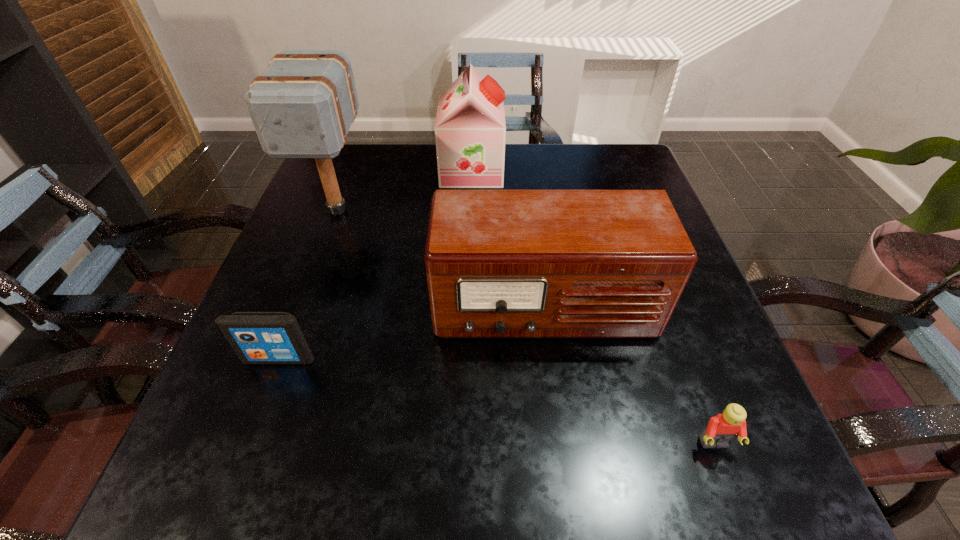
I want to click on free space at the far edge of the desktop, so click(395, 181).

You are a GUI agent. You are given a task and a screenshot of the screen. Output one action in this format:
    pyautogui.click(x=<x>, y=<y>)
    Task: Click on the blank space at the near edge of the desktop
    Image resolution: width=960 pixels, height=540 pixels.
    Given the screenshot: What is the action you would take?
    pyautogui.click(x=319, y=474)

Locate an element on the screen. free space at the left edge is located at coordinates (348, 218).

This screenshot has width=960, height=540. I want to click on vacant space at the near left corner, so click(x=267, y=455).

At what (x,y) coordinates should I click in order to perform the action: click on free region at the far right corner of the desktop. Please return your answer as a coordinate pair (x, y). Looking at the image, I should click on (594, 183).

Where is `empty space between the iPod and the mallet`? empty space between the iPod and the mallet is located at coordinates 308,284.

The image size is (960, 540). In order to click on vacant point located between the soya milk and the iPod in this screenshot , I will do `click(375, 264)`.

You are a GUI agent. You are given a task and a screenshot of the screen. Output one action in this format:
    pyautogui.click(x=<x>, y=<y>)
    Task: Click on the free space between the iPod and the tallest object
    
    Given the screenshot: What is the action you would take?
    pyautogui.click(x=308, y=284)

Where is `unoccupied area between the soya milk and the mallet`? unoccupied area between the soya milk and the mallet is located at coordinates (405, 190).

Locate an element on the screen. vacant area that lies between the fourth shortest object and the fourth farthest object is located at coordinates (375, 264).